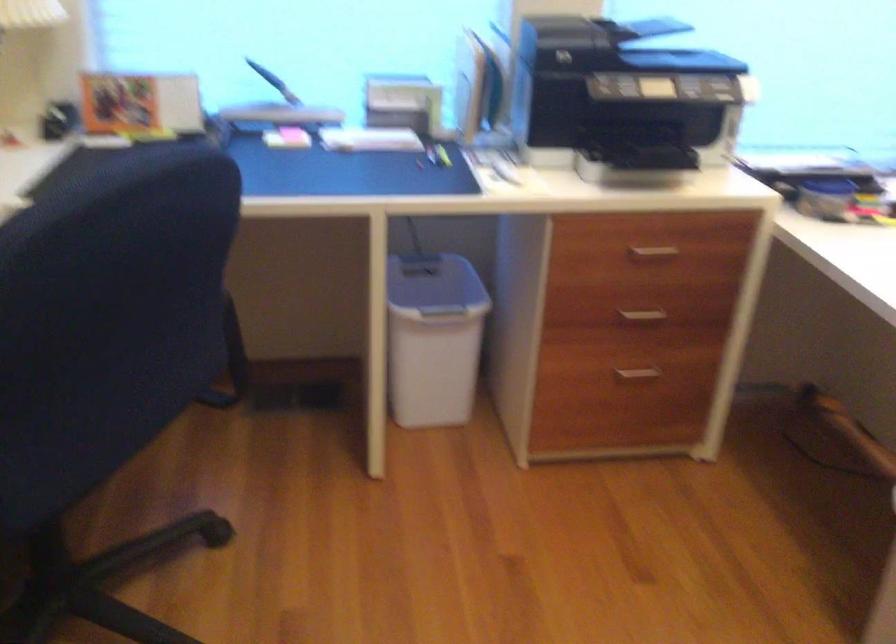
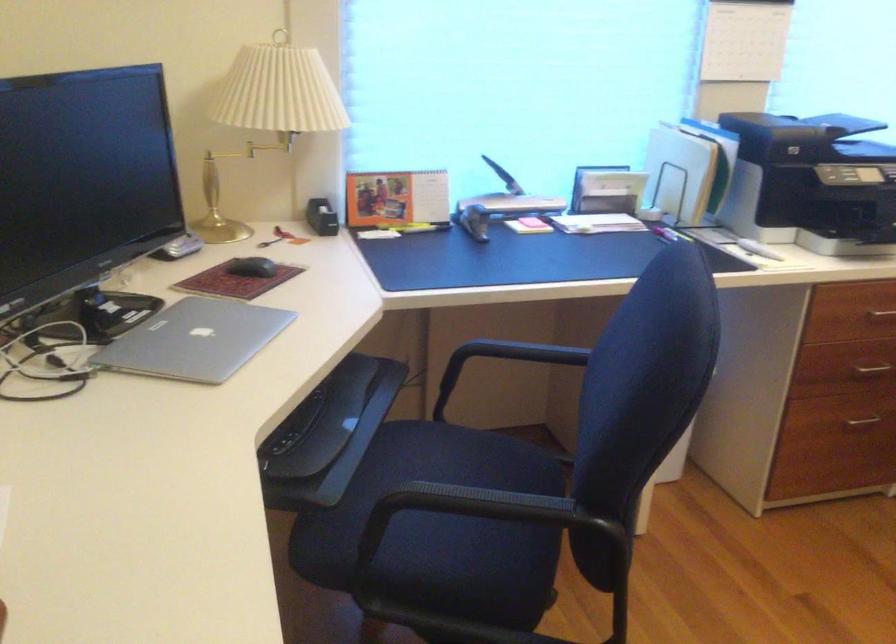
Where in the second image is the point corresponding to pixel 295 287 from the first image?

(502, 362)